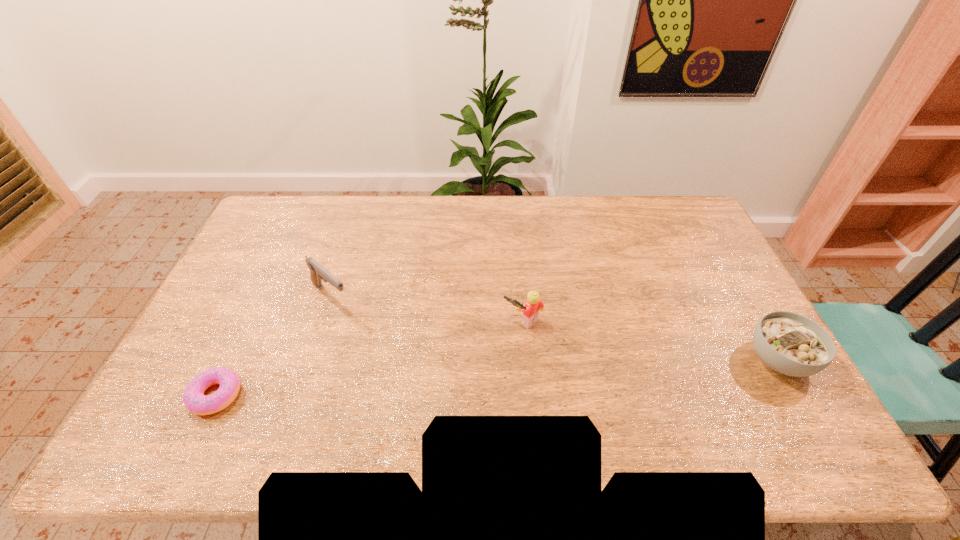
Where is `vacant region that satisfies the following two spatial constraints: 1. on the front side of the pistol; 2. on the right side of the second object from right to left`? The width and height of the screenshot is (960, 540). vacant region that satisfies the following two spatial constraints: 1. on the front side of the pistol; 2. on the right side of the second object from right to left is located at coordinates (322, 322).